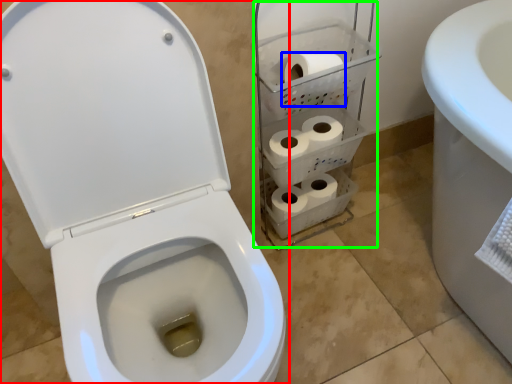
Question: Which object is the closest to the toilet (highlighted by a red box)? Choose among these: to paper (highlighted by a blue box) or shelf (highlighted by a green box).

Choices:
 (A) to paper
 (B) shelf

Answer: (B)